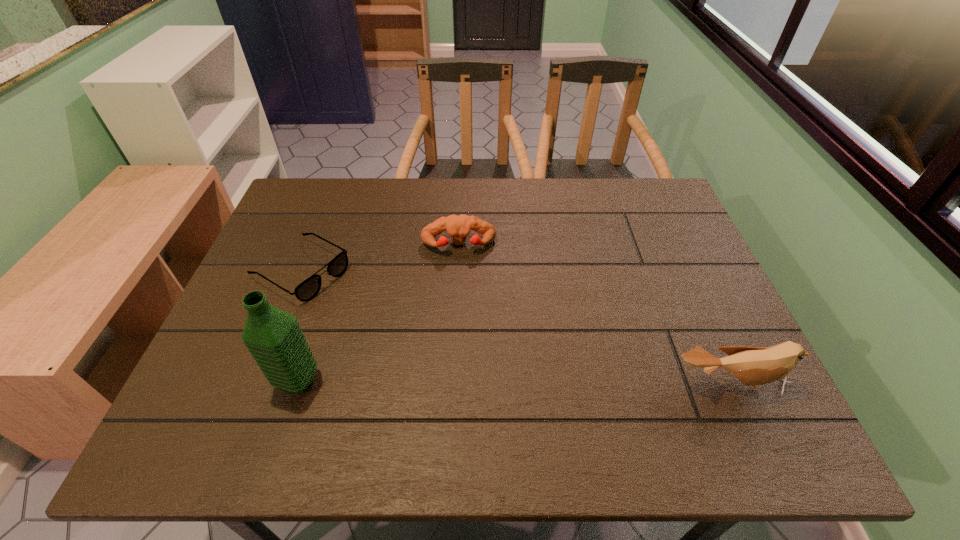
Locate an element on the screen. vacant space located with the gloves of the second object from right to left facing forward is located at coordinates (462, 284).

Image resolution: width=960 pixels, height=540 pixels. I want to click on vacant space positioned with the gloves of the second object from right to left facing forward, so click(464, 307).

You are a GUI agent. You are given a task and a screenshot of the screen. Output one action in this format:
    pyautogui.click(x=<x>, y=<y>)
    Task: Click on the free space located with the gloves of the second object from right to left facing forward
    The width and height of the screenshot is (960, 540).
    Given the screenshot: What is the action you would take?
    pyautogui.click(x=463, y=301)

Locate an element on the screen. This screenshot has height=540, width=960. water bottle that is at the near edge is located at coordinates (274, 338).

Where is `bird present at the near edge`? Image resolution: width=960 pixels, height=540 pixels. bird present at the near edge is located at coordinates (753, 366).

You are a GUI agent. You are given a task and a screenshot of the screen. Output one action in this format:
    pyautogui.click(x=<x>, y=<y>)
    Task: Click on the object located in the left edge section of the desktop
    The width and height of the screenshot is (960, 540).
    Given the screenshot: What is the action you would take?
    pyautogui.click(x=308, y=289)

Locate an element on the screen. The height and width of the screenshot is (540, 960). object that is at the right edge is located at coordinates (753, 366).

Where is `object that is at the near right corner`? Image resolution: width=960 pixels, height=540 pixels. object that is at the near right corner is located at coordinates (753, 366).

Where is `free location at the far edge`? free location at the far edge is located at coordinates (588, 211).

Find the location of a particular element. free space at the near edge of the desktop is located at coordinates (681, 392).